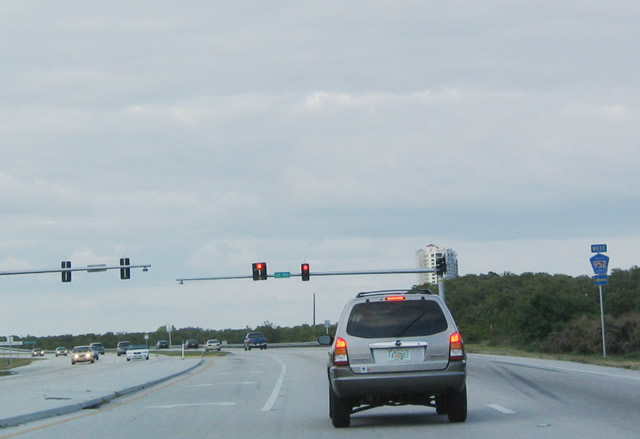
Identify the location of window. This screenshot has width=640, height=439. (411, 330).